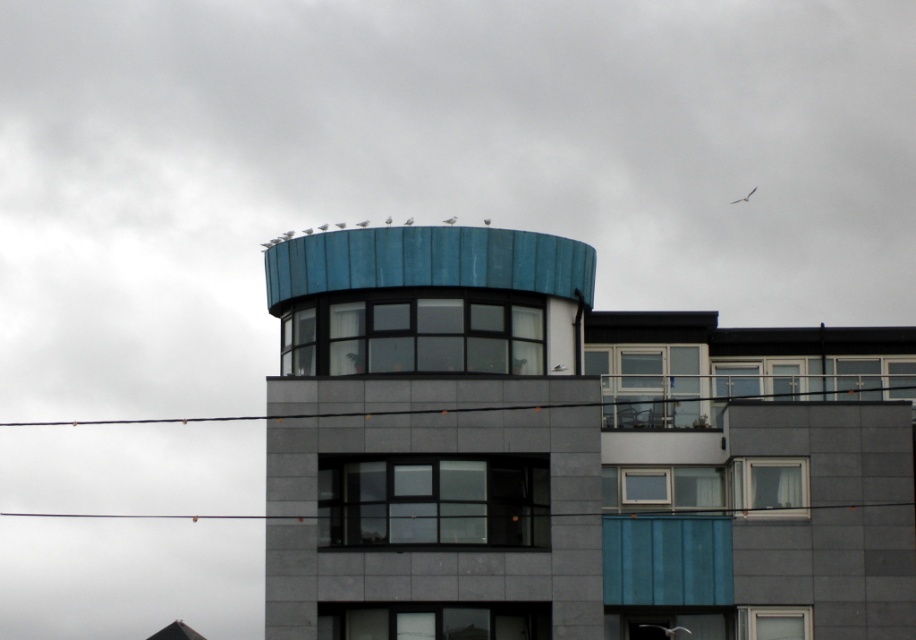
Can you confirm if blue textured tower at upper center is positioned to the left of white plastic window at lower right?

Yes, blue textured tower at upper center is to the left of white plastic window at lower right.

Which is behind, point (458, 481) or point (818, 580)?

Positioned behind is point (458, 481).

Locate an element on the screen. blue textured tower at upper center is located at coordinates (432, 426).